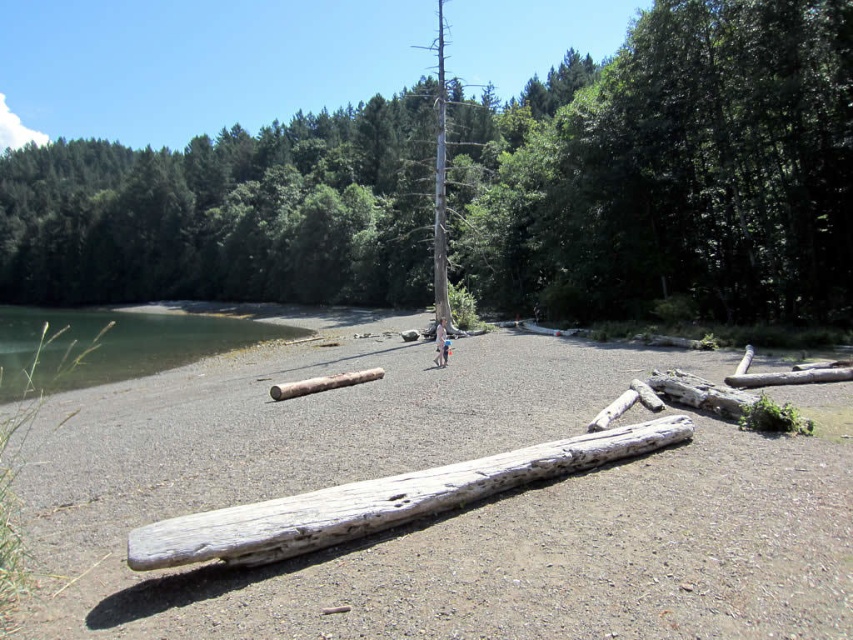
Question: Which point appears closest to the camera in this image?

Choices:
 (A) (48, 611)
 (B) (440, 333)

Answer: (A)

Question: Based on their relative distances, which object is farther from the gray bark tree at center?

Choices:
 (A) light blue fabric mountain biker at center
 (B) white weathered log at center
 (C) gray gravel at center
 (D) gray weathered log at center

Answer: (A)

Question: Among these points, which one is farthest from the camera?

Choices:
 (A) (341, 376)
 (B) (445, 337)
 (C) (136, 561)

Answer: (B)

Question: Does white weathered log at center appear on the left side of gray weathered log at center?

Choices:
 (A) no
 (B) yes

Answer: (A)

Question: Is white weathered log at center further to the viewer compared to gray weathered log at center?

Choices:
 (A) yes
 (B) no

Answer: (B)

Question: Can you confirm if gray bark tree at center is bigger than light blue fabric mountain biker at center?

Choices:
 (A) yes
 (B) no

Answer: (A)